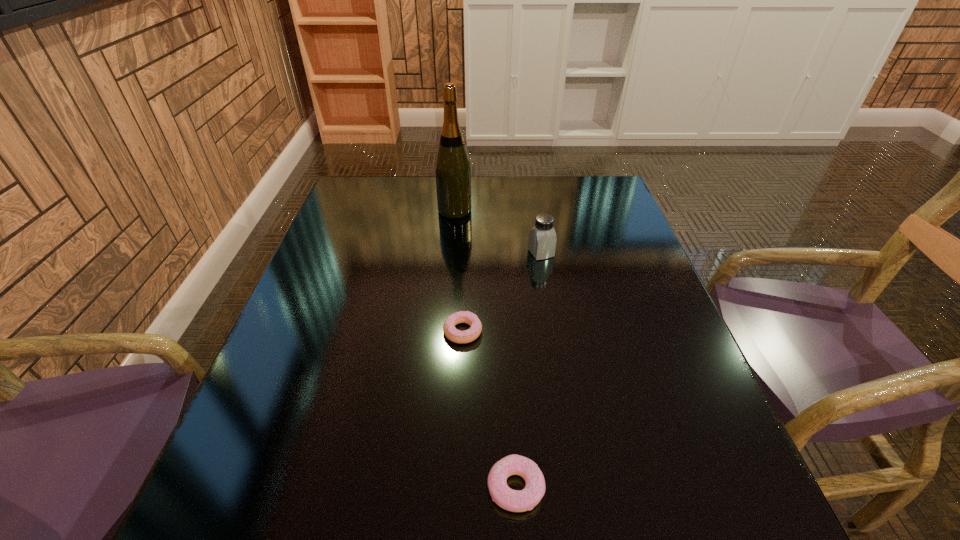
You are a GUI agent. You are given a task and a screenshot of the screen. Output one action in this format:
    pyautogui.click(x=<x>, y=<y>)
    Task: Click on the object that can be found as the closest to the nearer doughnut
    
    Given the screenshot: What is the action you would take?
    click(x=461, y=337)

Locate an element on the screen. Image resolution: width=960 pixels, height=540 pixels. free point that satisfies the following two spatial constraints: 1. on the front-facing side of the third shortest object; 2. on the right side of the tallest object is located at coordinates [451, 253].

You are a GUI agent. You are given a task and a screenshot of the screen. Output one action in this format:
    pyautogui.click(x=<x>, y=<y>)
    Task: Click on the vacant space that satisfies the following two spatial constraints: 1. on the front-facing side of the tallest object; 2. on the right side of the left doughnut
    
    Given the screenshot: What is the action you would take?
    pyautogui.click(x=445, y=331)

Locate an element on the screen. Image resolution: width=960 pixels, height=540 pixels. vacant region that satisfies the following two spatial constraints: 1. on the front-facing side of the tallest object; 2. on the left side of the second object from right to left is located at coordinates (433, 488).

This screenshot has height=540, width=960. Identify the location of vacant space that satisfies the following two spatial constraints: 1. on the front-facing side of the farthest object; 2. on the right side of the second nearest object. (445, 331).

Image resolution: width=960 pixels, height=540 pixels. In order to click on vacant point that satisfies the following two spatial constraints: 1. on the front side of the left doughnut; 2. on the right side of the nearer doughnut in this screenshot , I will do `click(456, 488)`.

Identify the location of free space that satisfies the following two spatial constraints: 1. on the front-facing side of the wine bottle; 2. on the back side of the right doughnut. (433, 488).

You are a GUI agent. You are given a task and a screenshot of the screen. Output one action in this format:
    pyautogui.click(x=<x>, y=<y>)
    Task: Click on the vacant region that satisfies the following two spatial constraints: 1. on the front-facing side of the third shortest object; 2. on the right side of the farthest object
    Image resolution: width=960 pixels, height=540 pixels.
    Given the screenshot: What is the action you would take?
    pyautogui.click(x=451, y=253)

Where is `free location that satisfies the following two spatial constraints: 1. on the back side of the saltshaker; 2. on the right side of the nearer doughnut`? The height and width of the screenshot is (540, 960). free location that satisfies the following two spatial constraints: 1. on the back side of the saltshaker; 2. on the right side of the nearer doughnut is located at coordinates coord(502,253).

This screenshot has height=540, width=960. In order to click on free point that satisfies the following two spatial constraints: 1. on the back side of the rightmost object; 2. on the front-facing side of the farthest object in this screenshot , I will do `click(534, 211)`.